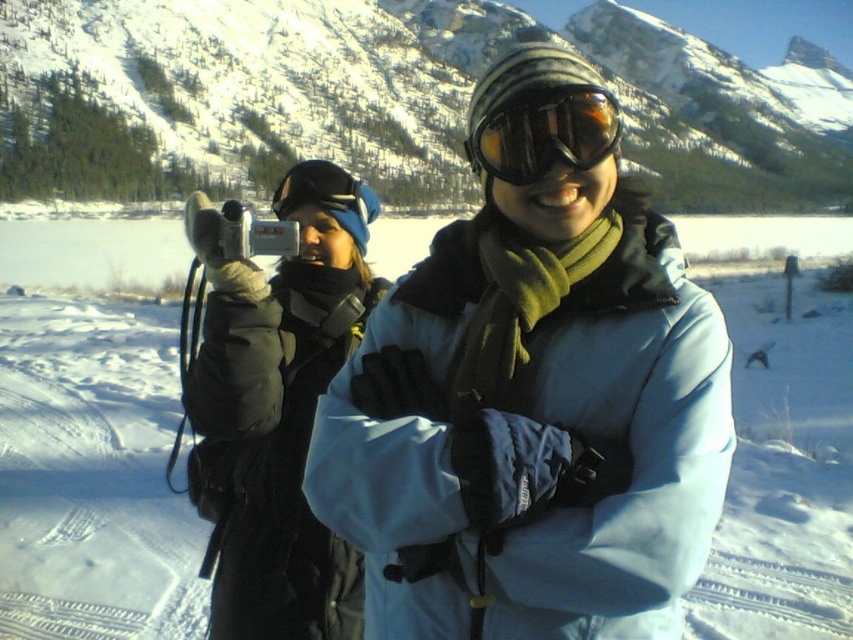
Question: Is matte gray jacket at center wider than matte black goggles at center?

Choices:
 (A) no
 (B) yes

Answer: (B)

Question: Is blue matte jacket at center closer to the viewer compared to matte black goggles at center?

Choices:
 (A) no
 (B) yes

Answer: (B)

Question: Can you confirm if blue matte jacket at center is bigger than snowy mountain at upper center?

Choices:
 (A) no
 (B) yes

Answer: (A)

Question: Among these points, which one is nearest to the camera?

Choices:
 (A) (61, 157)
 (B) (236, 429)
 (C) (506, 176)
 (D) (465, 333)

Answer: (C)

Question: Which of the following is the closest to the observer?

Choices:
 (A) matte black goggles at center
 (B) snowy mountain at upper center
 (C) blue matte jacket at center
 (D) matte gray jacket at center

Answer: (C)

Question: Which object appears farthest from the camera in this image?

Choices:
 (A) matte black goggles at center
 (B) matte gray jacket at center
 (C) blue matte jacket at center
 (D) snowy mountain at upper center

Answer: (D)